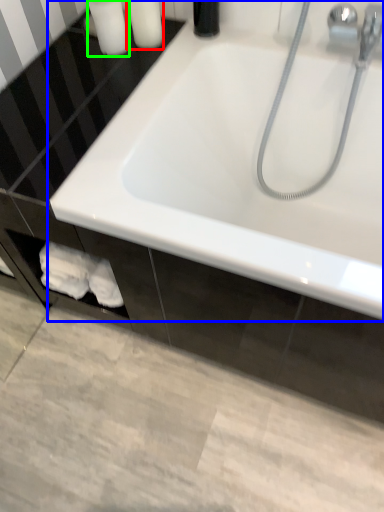
Question: Based on their relative distances, which object is farther from toiletry (highlighted by a red box)? Choose from bathtub (highlighted by a blue box) and toiletry (highlighted by a green box).

Choices:
 (A) bathtub
 (B) toiletry

Answer: (A)